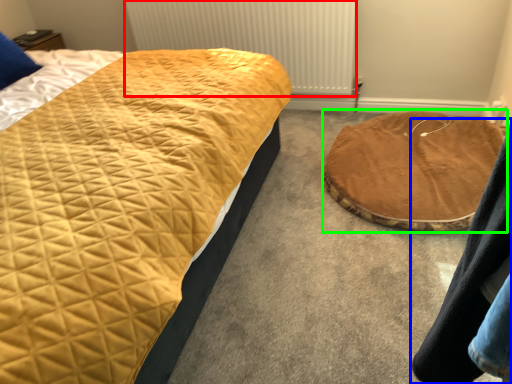
Question: Which object is positioned farthest from radiator (highlighted by a red box)? Select from couple (highlighted by a blue box) and cat bed (highlighted by a green box).

Choices:
 (A) couple
 (B) cat bed

Answer: (A)